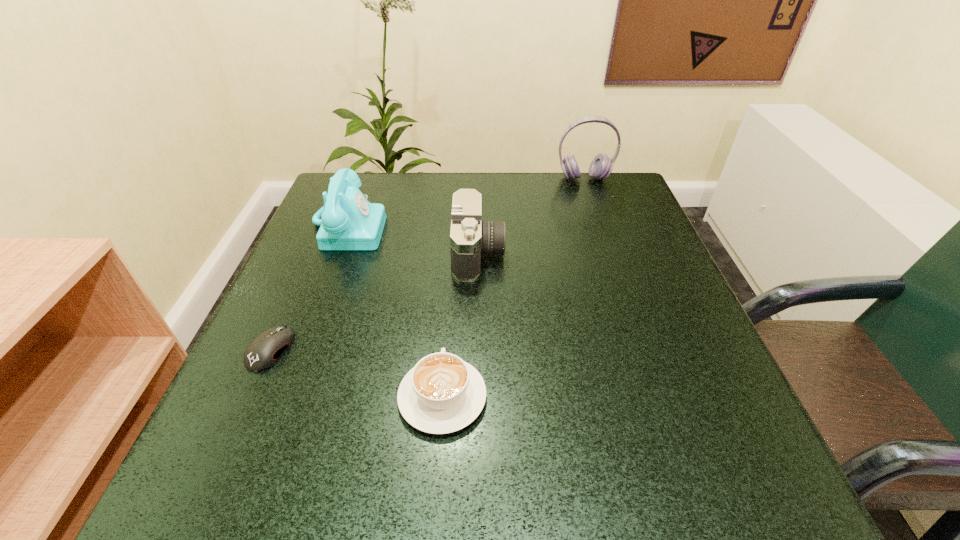
Where is `vacant space located on the side of the fourth tallest object with the handle`? vacant space located on the side of the fourth tallest object with the handle is located at coordinates (451, 276).

Find the location of a particular element. The width and height of the screenshot is (960, 540). free region located 0.280m on the side of the fourth tallest object with the handle is located at coordinates (453, 254).

Locate an element on the screen. vacant space located on the right of the computer equipment is located at coordinates coord(369,349).

Image resolution: width=960 pixels, height=540 pixels. What are the coordinates of `headset that is at the far edge` in the screenshot? It's located at (601, 166).

Locate an element on the screen. The height and width of the screenshot is (540, 960). telephone that is positioned at the far edge is located at coordinates (349, 221).

This screenshot has height=540, width=960. I want to click on telephone positioned at the left edge, so click(x=349, y=221).

Image resolution: width=960 pixels, height=540 pixels. I want to click on computer equipment that is at the left edge, so click(x=263, y=352).

The height and width of the screenshot is (540, 960). I want to click on object present at the right edge, so click(x=601, y=166).

Identify the location of object that is positioned at the far left corner. This screenshot has height=540, width=960. (349, 221).

Locate an element on the screen. object located in the far right corner section of the desktop is located at coordinates (601, 166).